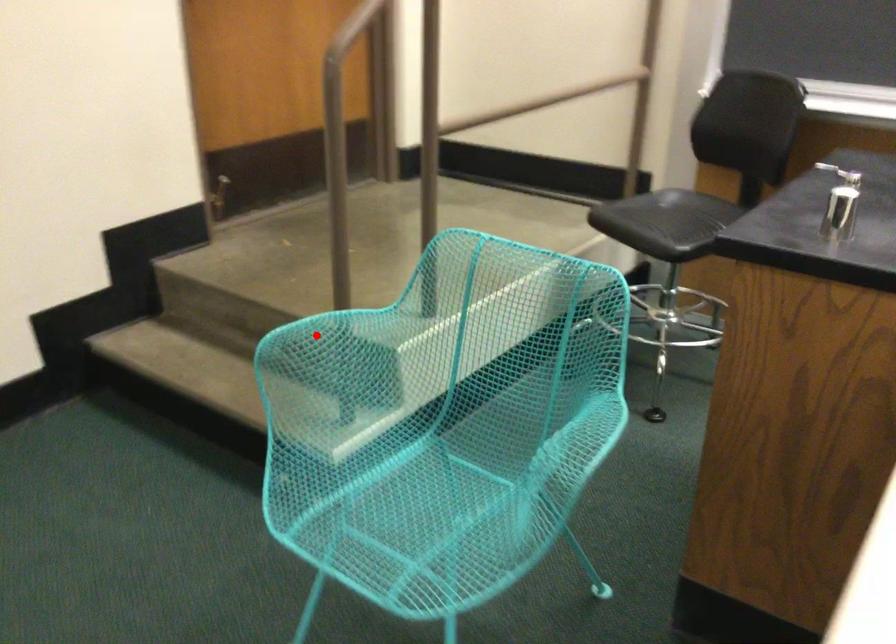
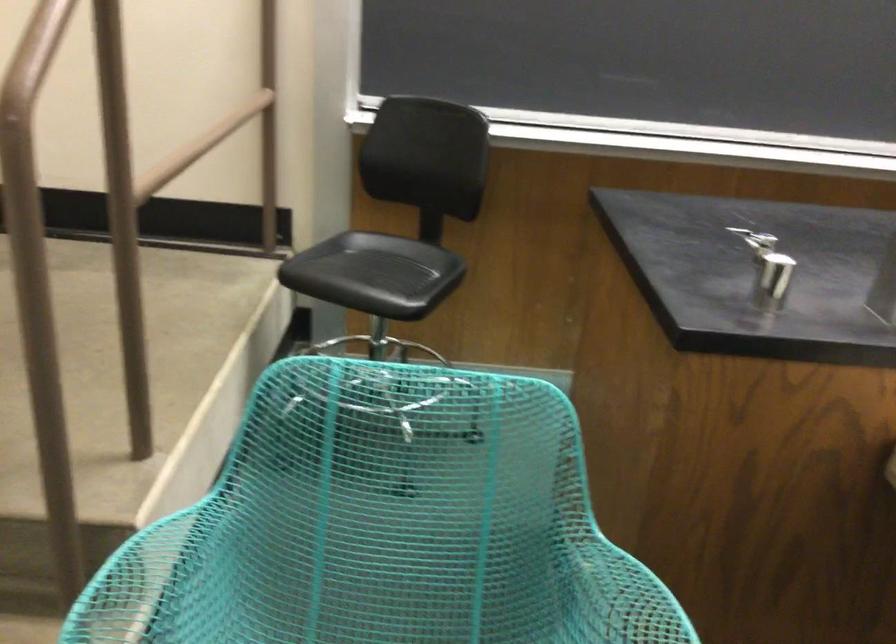
Question: I am providing you with two images of the same scene from different viewpoints. A red point is shown in image1. For the corresponding object point in image2, is it positioned nearer or farther from the camera?

Choices:
 (A) Nearer
 (B) Farther

Answer: (A)